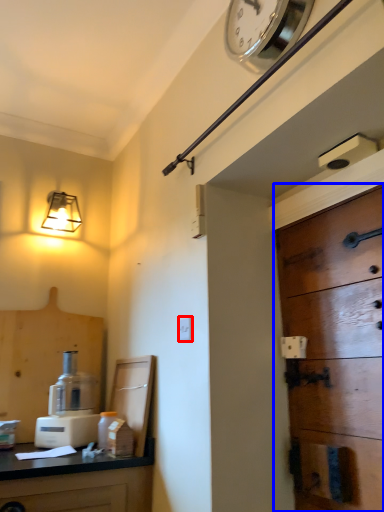
Question: Which point is closer to the camera, light switch (highlighted by a red box) or door (highlighted by a blue box)?

Choices:
 (A) light switch
 (B) door

Answer: (B)